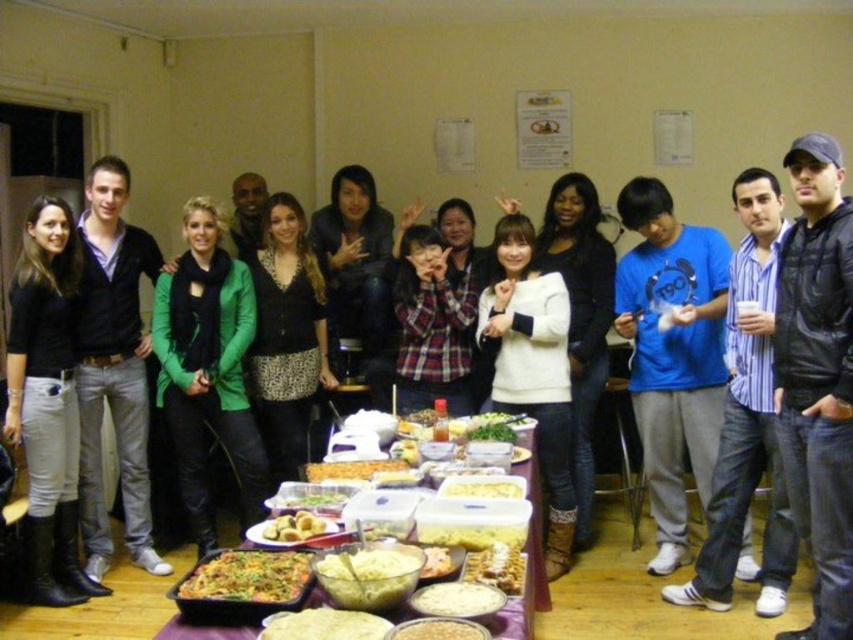
Question: Can you confirm if white creamy dip at center is positioned below smooth white bread at center?

Choices:
 (A) yes
 (B) no

Answer: (A)

Question: Among these points, which one is farthest from the camera?

Choices:
 (A) (445, 561)
 (B) (675, 339)
 (C) (312, 618)

Answer: (B)

Question: Which point appears closest to the camera in this image?

Choices:
 (A) (358, 468)
 (B) (241, 285)

Answer: (A)

Question: Is golden crispy chips at center to the left of white creamy pasta at center from the viewer's perspective?

Choices:
 (A) yes
 (B) no

Answer: (A)

Question: Estimate the real-world distances between objects in this image. Which object is closer to the golden fried dumplings at center?

Choices:
 (A) golden crispy chips at center
 (B) golden brown bread at center
 (C) golden brown casserole at center
 (D) blue cotton shirt at center

Answer: (C)

Question: Is white creamy dip at center behind green leafy vegetables at center?

Choices:
 (A) no
 (B) yes

Answer: (A)